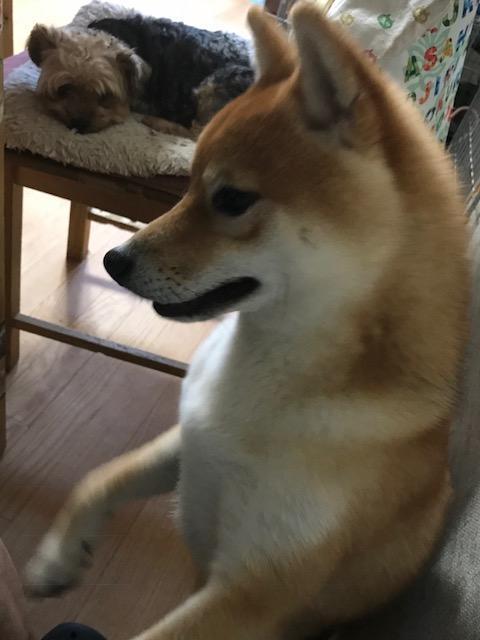
Identify the location of floor. The width and height of the screenshot is (480, 640). click(103, 418).